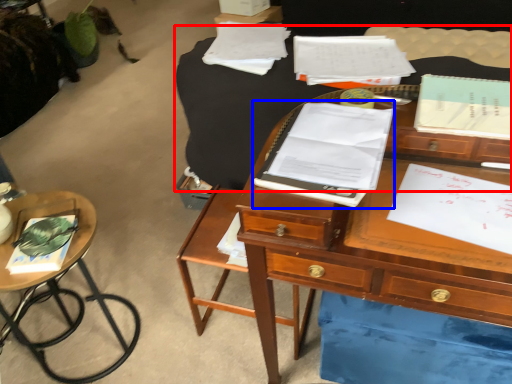
Question: Among these objects, which one is farthest to the camera, table (highlighted by a red box) or notebook (highlighted by a blue box)?

Choices:
 (A) table
 (B) notebook

Answer: (A)